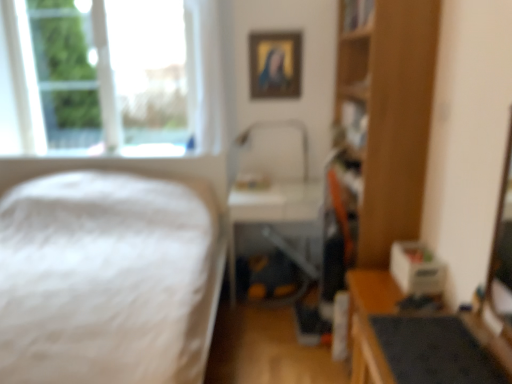
Question: From a real-world perspective, is transparent glass window at upper left positioned above or below white fluffy bed at left?

Choices:
 (A) above
 (B) below

Answer: (A)

Question: In the image, is transparent glass window at upper left positioned in front of or behind white fluffy bed at left?

Choices:
 (A) behind
 (B) front

Answer: (A)

Question: Estimate the real-world distances between objects in this image. Which object is farther from the transparent glass window at upper left?

Choices:
 (A) white fluffy bed at left
 (B) wooden table at lower right
 (C) metallic gray table at center
 (D) wooden bookshelf at right
 (E) gold-framed portrait at upper center

Answer: (B)

Question: Based on their relative distances, which object is farther from the wooden table at lower right?

Choices:
 (A) white fluffy bed at left
 (B) gold-framed portrait at upper center
 (C) wooden bookshelf at right
 (D) transparent glass window at upper left
 (E) metallic gray table at center

Answer: (D)